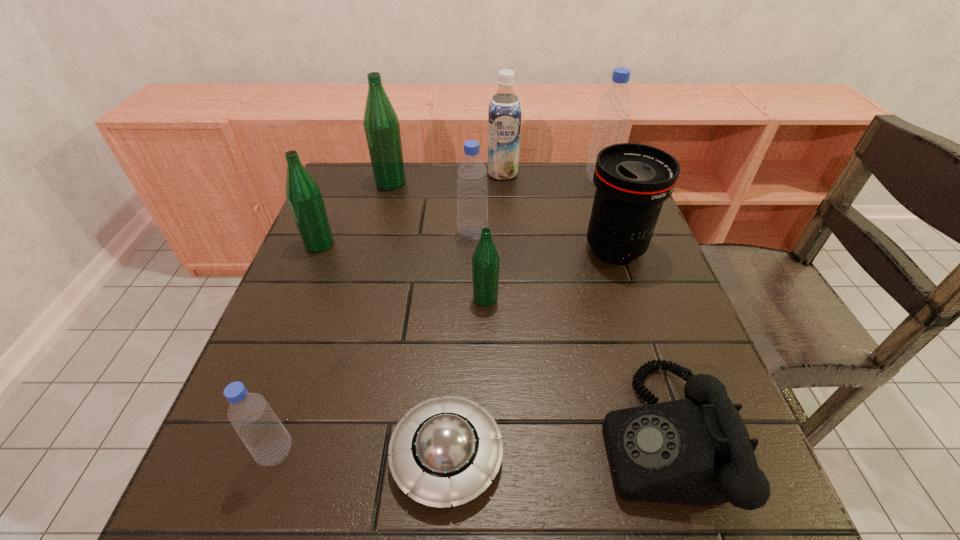
Identify the location of vacant point at the far edge. This screenshot has height=540, width=960. (489, 197).

Locate an element on the screen. vacant area at the left edge of the desktop is located at coordinates (381, 218).

Where is `vacant point at the right edge`? This screenshot has width=960, height=540. vacant point at the right edge is located at coordinates (592, 254).

The width and height of the screenshot is (960, 540). I want to click on vacant region at the far left corner of the desktop, so click(x=375, y=188).

The width and height of the screenshot is (960, 540). In order to click on free point between the rightmost green bottle and the shortest object in this screenshot , I will do `click(467, 377)`.

This screenshot has height=540, width=960. I want to click on vacant point located between the black telephoto lens and the gray saucer, so click(531, 352).

Image resolution: width=960 pixels, height=540 pixels. Identify the location of free space between the gray saucer and the farthest green bottle. (419, 319).

Where is `free space that is in between the black telephoto lens and the smallest green bottle`? free space that is in between the black telephoto lens and the smallest green bottle is located at coordinates (550, 274).

The height and width of the screenshot is (540, 960). I want to click on free area in between the soya milk and the leftmost green bottle, so click(x=411, y=208).

In order to click on vacant area between the farthest green bottle and the rightmost bottle in this screenshot , I will do `click(495, 180)`.